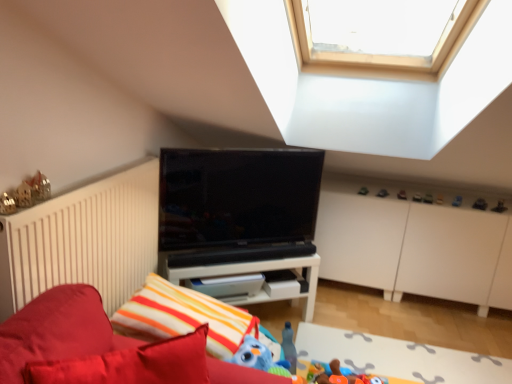
Question: Are green matte toy at upper right, the third toy in the left-to-right sequence, and soft plush toy at lower center, the tenth toy when ordered from right to left, far apart?

Choices:
 (A) yes
 (B) no

Answer: (A)

Question: Is green matte toy at upper right, the 1th toy from the back, positioned behind soft plush toy at lower center, the tenth toy when ordered from right to left?

Choices:
 (A) no
 (B) yes

Answer: (B)

Question: From the image's perspective, is green matte toy at upper right, the third toy in the left-to-right sequence, on soft plush toy at lower center, which is counted as the 2th toy, starting from the left?

Choices:
 (A) no
 (B) yes

Answer: (B)

Question: Does green matte toy at upper right, the 1th toy from the back, have a lesser height compared to soft plush toy at lower center, acting as the second toy starting from the front?

Choices:
 (A) yes
 (B) no

Answer: (A)

Question: Is green matte toy at upper right, the third toy in the left-to-right sequence, facing towards soft plush toy at lower center, acting as the second toy starting from the front?

Choices:
 (A) yes
 (B) no

Answer: (A)

Question: In the image, is metallic black toy at upper right, acting as the second toy starting from the right, on the left side or the right side of blue rubber duck at upper center, which ranks as the ninth toy in left-to-right order?

Choices:
 (A) left
 (B) right

Answer: (B)

Question: Does point (486, 205) appear closer or farther from the camera than point (456, 201)?

Choices:
 (A) farther
 (B) closer

Answer: (A)

Question: From the image's perspective, is metallic black toy at upper right, which is the 8th toy from back to front, located above or below blue rubber duck at upper center, placed as the 7th toy when sorted from back to front?

Choices:
 (A) above
 (B) below

Answer: (B)

Question: From a real-world perspective, is metallic black toy at upper right, which is the 8th toy from back to front, above or below blue rubber duck at upper center, the 3th toy viewed from the right?

Choices:
 (A) below
 (B) above

Answer: (A)

Question: Is blue rubber duck at upper center, the 3th toy viewed from the right, spatially inside black glossy tv at center, or outside of it?

Choices:
 (A) outside
 (B) inside

Answer: (A)

Question: Is point (457, 198) closer or farther from the camera than point (314, 162)?

Choices:
 (A) closer
 (B) farther

Answer: (B)

Question: In terms of size, does blue rubber duck at upper center, placed as the 7th toy when sorted from back to front, appear bigger or smaller than black glossy tv at center?

Choices:
 (A) big
 (B) small

Answer: (B)

Question: From the image's perspective, is blue rubber duck at upper center, the 3th toy viewed from the right, positioned above or below black glossy tv at center?

Choices:
 (A) above
 (B) below

Answer: (B)

Question: Considering their positions, is white soft rug at lower center located in front of or behind blue rubber duck at upper center, the fifth toy from the front?

Choices:
 (A) behind
 (B) front

Answer: (B)

Question: Is white soft rug at lower center situated inside blue rubber duck at upper center, the 3th toy viewed from the right, or outside?

Choices:
 (A) inside
 (B) outside

Answer: (B)